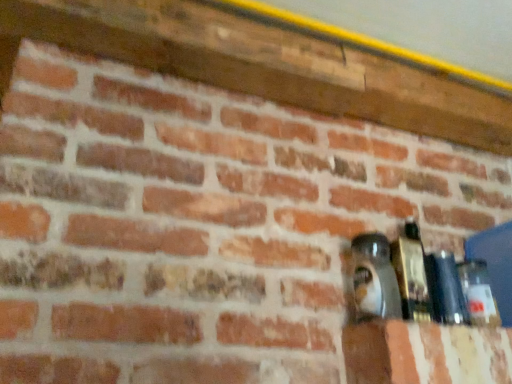
In order to face matte glass bottle at right, acting as the 2th bottle starting from the left, should I rotate leftwards or rightwards?

It's best to rotate right around 19.661 degrees.

Image resolution: width=512 pixels, height=384 pixels. What do you see at coordinates (374, 278) in the screenshot?
I see `matte black bottle at right, the first bottle viewed from the left` at bounding box center [374, 278].

Find the location of a particular element. The image size is (512, 384). matte glass bottle at right, the third bottle from the right is located at coordinates (412, 274).

Would you say matte black bottle at right, the 2th bottle in the right-to-left sequence, is to the left or to the right of clear glass bottle at right, marked as the fourth bottle in a left-to-right arrangement, in the picture?

In the image, matte black bottle at right, the 2th bottle in the right-to-left sequence, appears on the left side of clear glass bottle at right, marked as the fourth bottle in a left-to-right arrangement.

Is point (430, 284) in front of point (493, 324)?

Yes, it is in front of point (493, 324).

Is matte black bottle at right, the 2th bottle in the right-to-left sequence, bigger or smaller than clear glass bottle at right, positioned as the first bottle in right-to-left order?

Considering their sizes, matte black bottle at right, the 2th bottle in the right-to-left sequence, takes up more space than clear glass bottle at right, positioned as the first bottle in right-to-left order.

How much distance is there between matte black bottle at right, placed as the third bottle when sorted from left to right, and clear glass bottle at right, positioned as the first bottle in right-to-left order?

matte black bottle at right, placed as the third bottle when sorted from left to right, is 6.77 centimeters away from clear glass bottle at right, positioned as the first bottle in right-to-left order.

Is the surface of clear glass bottle at right, marked as the fourth bottle in a left-to-right arrangement, in direct contact with matte glass bottle at right, the third bottle from the right?

clear glass bottle at right, marked as the fourth bottle in a left-to-right arrangement, and matte glass bottle at right, the third bottle from the right, are clearly separated.

Is point (479, 282) closer or farther from the camera than point (417, 240)?

Clearly, point (479, 282) is closer to the camera than point (417, 240).

Is clear glass bottle at right, marked as the fourth bottle in a left-to-right arrangement, at the left side of matte glass bottle at right, the third bottle from the right?

In fact, clear glass bottle at right, marked as the fourth bottle in a left-to-right arrangement, is to the right of matte glass bottle at right, the third bottle from the right.

From a real-world perspective, is clear glass bottle at right, marked as the fourth bottle in a left-to-right arrangement, under matte glass bottle at right, acting as the 2th bottle starting from the left?

Yes, from a real-world perspective, clear glass bottle at right, marked as the fourth bottle in a left-to-right arrangement, is below matte glass bottle at right, acting as the 2th bottle starting from the left.

From the image's perspective, which is above, clear glass bottle at right, positioned as the first bottle in right-to-left order, or matte black bottle at right, the first bottle viewed from the left?

matte black bottle at right, the first bottle viewed from the left, from the image's perspective.

What's the angular difference between clear glass bottle at right, marked as the fourth bottle in a left-to-right arrangement, and matte black bottle at right, which is the 4th bottle in right-to-left order,'s facing directions?

0.00344 degrees.

Is clear glass bottle at right, marked as the fourth bottle in a left-to-right arrangement, next to matte black bottle at right, the first bottle viewed from the left, and touching it?

There is a gap between clear glass bottle at right, marked as the fourth bottle in a left-to-right arrangement, and matte black bottle at right, the first bottle viewed from the left.

At what (x,y) coordinates should I click in order to perform the action: click on bottle that is the 3rd one when counting backward from the matte black bottle at right, the first bottle viewed from the left. Please return your answer as a coordinate pair (x, y). The width and height of the screenshot is (512, 384). Looking at the image, I should click on (478, 293).

From the image's perspective, which object appears higher, matte glass bottle at right, acting as the 2th bottle starting from the left, or matte black bottle at right, the 2th bottle in the right-to-left sequence?

matte glass bottle at right, acting as the 2th bottle starting from the left, appears higher in the image.

Between matte glass bottle at right, the third bottle from the right, and matte black bottle at right, the 2th bottle in the right-to-left sequence, which one has smaller width?

Thinner between the two is matte black bottle at right, the 2th bottle in the right-to-left sequence.

Can you confirm if matte glass bottle at right, the third bottle from the right, is positioned to the left of matte black bottle at right, placed as the third bottle when sorted from left to right?

Yes.

Does matte glass bottle at right, acting as the 2th bottle starting from the left, have a larger size compared to matte black bottle at right, the 2th bottle in the right-to-left sequence?

Yes, matte glass bottle at right, acting as the 2th bottle starting from the left, is bigger than matte black bottle at right, the 2th bottle in the right-to-left sequence.

From the image's perspective, is matte black bottle at right, which is the 4th bottle in right-to-left order, located above or below clear glass bottle at right, marked as the fourth bottle in a left-to-right arrangement?

Based on their image positions, matte black bottle at right, which is the 4th bottle in right-to-left order, is located above clear glass bottle at right, marked as the fourth bottle in a left-to-right arrangement.

Can you see matte black bottle at right, which is the 4th bottle in right-to-left order, touching clear glass bottle at right, marked as the fourth bottle in a left-to-right arrangement?

matte black bottle at right, which is the 4th bottle in right-to-left order, and clear glass bottle at right, marked as the fourth bottle in a left-to-right arrangement, are clearly separated.

Is matte black bottle at right, which is the 4th bottle in right-to-left order, facing away from clear glass bottle at right, positioned as the first bottle in right-to-left order?

matte black bottle at right, which is the 4th bottle in right-to-left order, does not have its back to clear glass bottle at right, positioned as the first bottle in right-to-left order.

Is matte black bottle at right, the first bottle viewed from the left, outside of clear glass bottle at right, positioned as the first bottle in right-to-left order?

Absolutely, matte black bottle at right, the first bottle viewed from the left, is external to clear glass bottle at right, positioned as the first bottle in right-to-left order.

Considering the positions of objects clear glass bottle at right, positioned as the first bottle in right-to-left order, and matte black bottle at right, the 2th bottle in the right-to-left sequence, in the image provided, who is in front, clear glass bottle at right, positioned as the first bottle in right-to-left order, or matte black bottle at right, the 2th bottle in the right-to-left sequence,?

matte black bottle at right, the 2th bottle in the right-to-left sequence.

From a real-world perspective, is clear glass bottle at right, positioned as the first bottle in right-to-left order, positioned under matte black bottle at right, placed as the third bottle when sorted from left to right, based on gravity?

Yes, from a real-world perspective, clear glass bottle at right, positioned as the first bottle in right-to-left order, is below matte black bottle at right, placed as the third bottle when sorted from left to right.

From the image's perspective, is clear glass bottle at right, positioned as the first bottle in right-to-left order, above or below matte black bottle at right, the 2th bottle in the right-to-left sequence?

From the image's perspective, clear glass bottle at right, positioned as the first bottle in right-to-left order, appears below matte black bottle at right, the 2th bottle in the right-to-left sequence.

Based on the photo, does matte glass bottle at right, acting as the 2th bottle starting from the left, turn towards clear glass bottle at right, positioned as the first bottle in right-to-left order?

No, matte glass bottle at right, acting as the 2th bottle starting from the left, is not facing towards clear glass bottle at right, positioned as the first bottle in right-to-left order.

Which point is more distant from viewer, (x=402, y=269) or (x=470, y=279)?

The point (x=470, y=279) is behind.

What's the angular difference between matte glass bottle at right, acting as the 2th bottle starting from the left, and clear glass bottle at right, marked as the fourth bottle in a left-to-right arrangement,'s facing directions?

There is a 0.000906-degree angle between the facing directions of matte glass bottle at right, acting as the 2th bottle starting from the left, and clear glass bottle at right, marked as the fourth bottle in a left-to-right arrangement.

Could clear glass bottle at right, marked as the fourth bottle in a left-to-right arrangement, be considered to be inside matte glass bottle at right, the third bottle from the right?

That's incorrect, clear glass bottle at right, marked as the fourth bottle in a left-to-right arrangement, is not inside matte glass bottle at right, the third bottle from the right.

From the clear glass bottle at right, positioned as the first bottle in right-to-left order, count the 1st bottle to the left and point to it. Please provide its 2D coordinates.

[(446, 289)]

There is a clear glass bottle at right, positioned as the first bottle in right-to-left order. Where is `the 2nd bottle above it (from the image's perspective)`? the 2nd bottle above it (from the image's perspective) is located at coordinates (412, 274).

Looking at this image, based on their spatial positions, is matte glass bottle at right, the third bottle from the right, or matte black bottle at right, which is the 4th bottle in right-to-left order, closer to matte black bottle at right, placed as the third bottle when sorted from left to right?

matte glass bottle at right, the third bottle from the right, is closer to matte black bottle at right, placed as the third bottle when sorted from left to right.

When comparing their distances from matte glass bottle at right, acting as the 2th bottle starting from the left, does matte black bottle at right, the 2th bottle in the right-to-left sequence, or matte black bottle at right, which is the 4th bottle in right-to-left order, seem closer?

matte black bottle at right, which is the 4th bottle in right-to-left order, is closer to matte glass bottle at right, acting as the 2th bottle starting from the left.

Looking at the image, which one is located further to matte glass bottle at right, the third bottle from the right, clear glass bottle at right, positioned as the first bottle in right-to-left order, or matte black bottle at right, the 2th bottle in the right-to-left sequence?

clear glass bottle at right, positioned as the first bottle in right-to-left order, is further to matte glass bottle at right, the third bottle from the right.

Looking at the image, which one is located closer to matte glass bottle at right, acting as the 2th bottle starting from the left, matte black bottle at right, which is the 4th bottle in right-to-left order, or matte black bottle at right, the 2th bottle in the right-to-left sequence?

matte black bottle at right, which is the 4th bottle in right-to-left order, is closer to matte glass bottle at right, acting as the 2th bottle starting from the left.

Estimate the real-world distances between objects in this image. Which object is closer to clear glass bottle at right, marked as the fourth bottle in a left-to-right arrangement, matte glass bottle at right, acting as the 2th bottle starting from the left, or matte black bottle at right, placed as the third bottle when sorted from left to right?

matte black bottle at right, placed as the third bottle when sorted from left to right, is closer to clear glass bottle at right, marked as the fourth bottle in a left-to-right arrangement.

Looking at the image, which one is located closer to clear glass bottle at right, marked as the fourth bottle in a left-to-right arrangement, matte black bottle at right, which is the 4th bottle in right-to-left order, or matte black bottle at right, the 2th bottle in the right-to-left sequence?

The object closer to clear glass bottle at right, marked as the fourth bottle in a left-to-right arrangement, is matte black bottle at right, the 2th bottle in the right-to-left sequence.

Which object lies further to the anchor point clear glass bottle at right, positioned as the first bottle in right-to-left order, matte black bottle at right, the first bottle viewed from the left, or matte glass bottle at right, the third bottle from the right?

The object further to clear glass bottle at right, positioned as the first bottle in right-to-left order, is matte black bottle at right, the first bottle viewed from the left.

Which object lies further to the anchor point clear glass bottle at right, positioned as the first bottle in right-to-left order, matte black bottle at right, placed as the third bottle when sorted from left to right, or matte glass bottle at right, the third bottle from the right?

matte glass bottle at right, the third bottle from the right, is positioned further to the anchor clear glass bottle at right, positioned as the first bottle in right-to-left order.

Identify the location of bottle situated between matte glass bottle at right, the third bottle from the right, and clear glass bottle at right, positioned as the first bottle in right-to-left order, from left to right. This screenshot has width=512, height=384. (446, 289).

Locate an element on the screen. Image resolution: width=512 pixels, height=384 pixels. bottle between matte black bottle at right, which is the 4th bottle in right-to-left order, and matte black bottle at right, the 2th bottle in the right-to-left sequence is located at coordinates (412, 274).